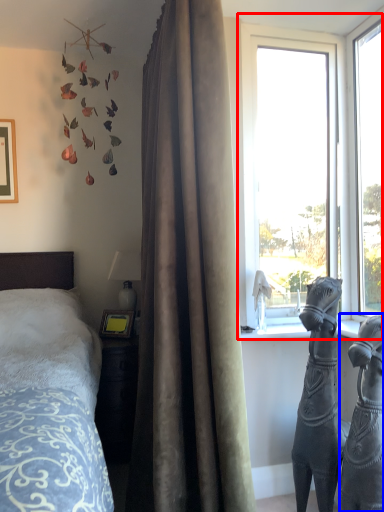
Question: Among these objects, which one is nearest to the camera, window (highlighted by a red box) or sculpture (highlighted by a blue box)?

Choices:
 (A) window
 (B) sculpture

Answer: (B)